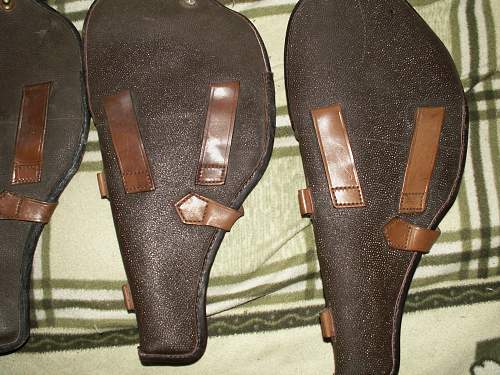
This screenshot has height=375, width=500. In order to click on fabric in this screenshot , I will do `click(278, 310)`.